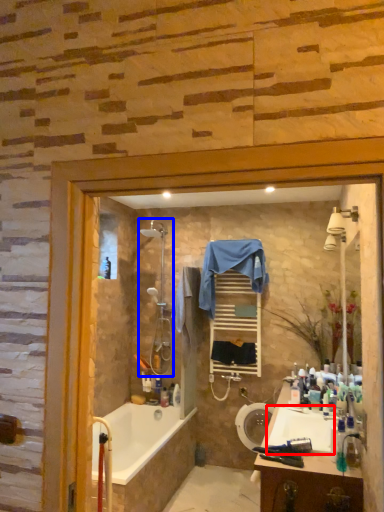
Question: Among these objects, which one is farthest to the camera, sink (highlighted by a red box) or shower (highlighted by a blue box)?

Choices:
 (A) sink
 (B) shower

Answer: (B)